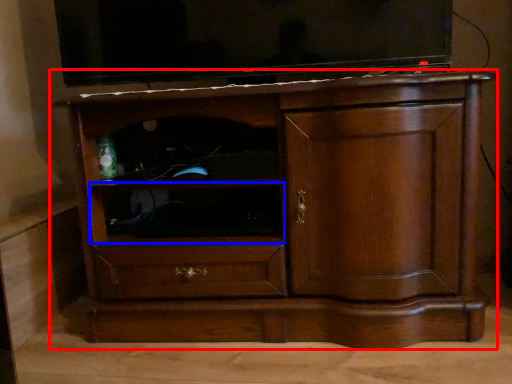
Question: Which object appears closest to the camera in this image, chest of drawers (highlighted by a red box) or shelf (highlighted by a blue box)?

Choices:
 (A) chest of drawers
 (B) shelf

Answer: (A)